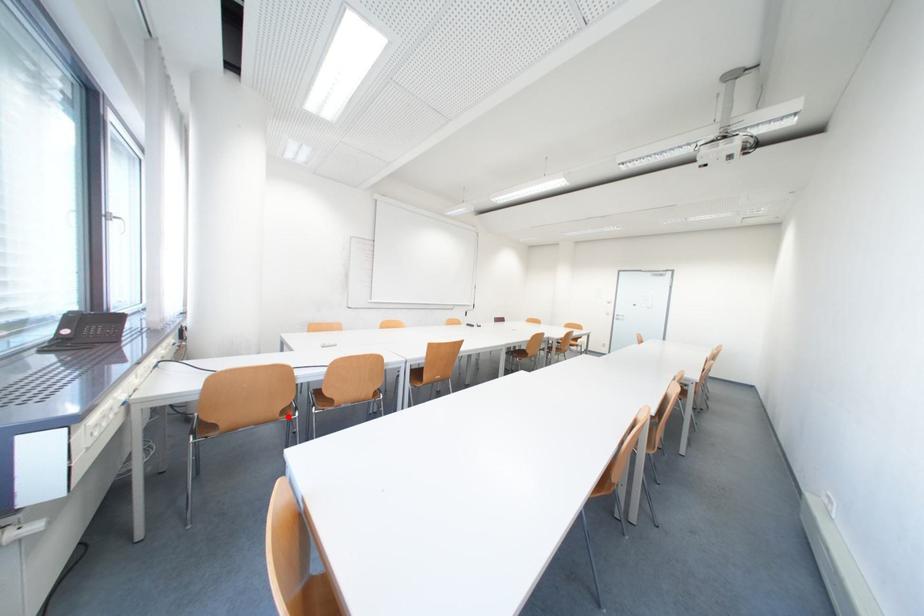
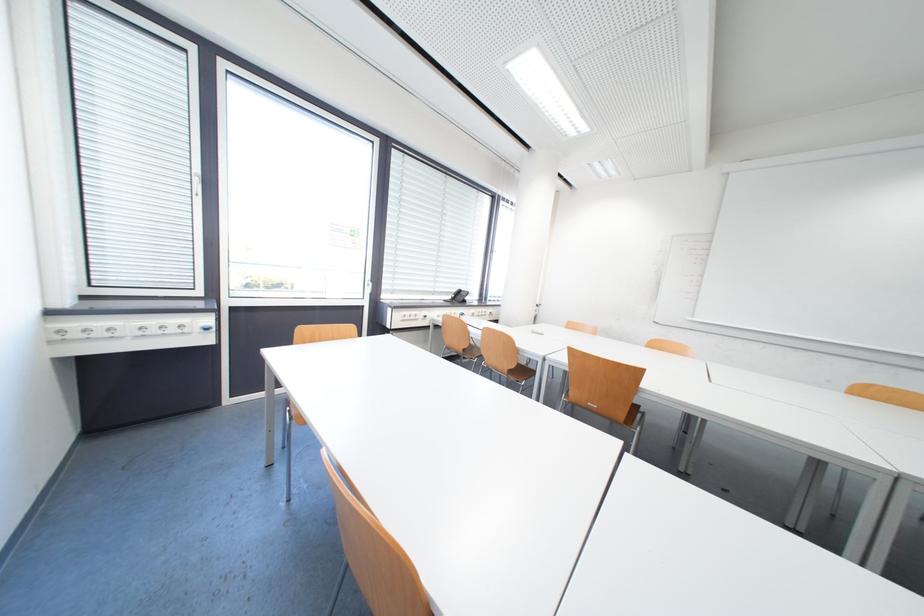
Question: I am providing you with two images of the same scene from different viewpoints. A red point is shown in image1. For the corresponding object point in image2, is it positioned nearer or farther from the camera?

Choices:
 (A) Nearer
 (B) Farther

Answer: (B)